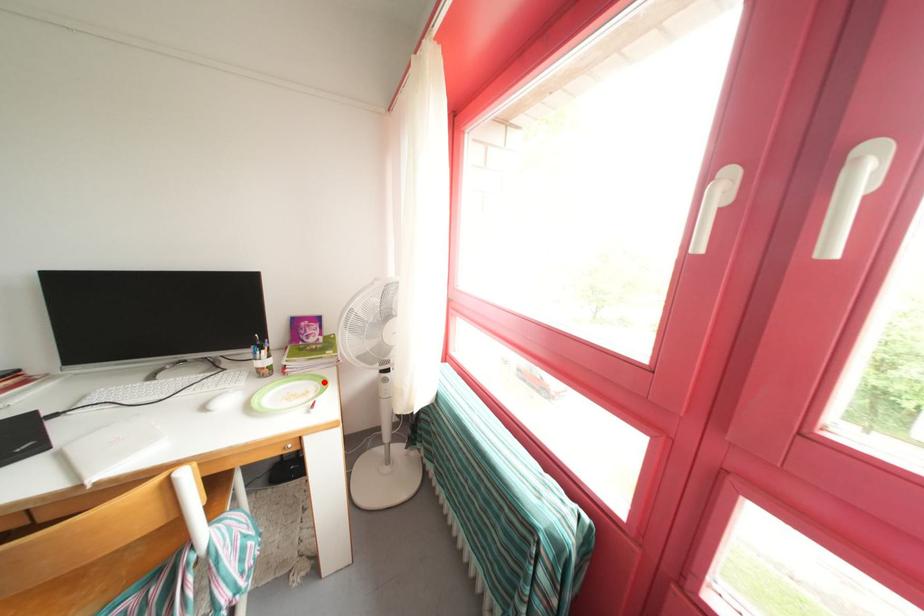
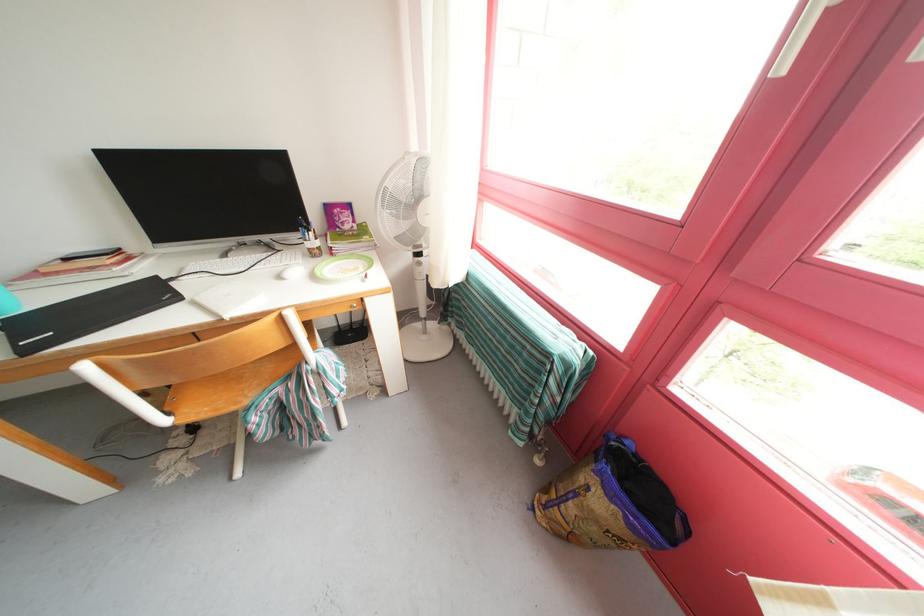
Locate, in the second image, the point that corresponds to the highlighted location in the first image.

(369, 262)